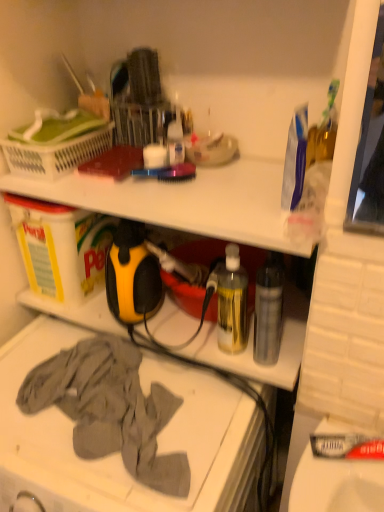
Question: Is translucent plastic bottle at center, placed as the 2th bottle when sorted from right to left, outside of transparent plastic bottle at center-right, which ranks as the 2th bottle in left-to-right order?

Choices:
 (A) yes
 (B) no

Answer: (A)

Question: From the image's perspective, is translucent plastic bottle at center, placed as the 2th bottle when sorted from right to left, beneath transparent plastic bottle at center-right, which ranks as the 2th bottle in left-to-right order?

Choices:
 (A) yes
 (B) no

Answer: (B)

Question: Considering the relative sizes of translucent plastic bottle at center, placed as the 2th bottle when sorted from right to left, and transparent plastic bottle at center-right, acting as the 1th bottle starting from the right, in the image provided, is translucent plastic bottle at center, placed as the 2th bottle when sorted from right to left, bigger than transparent plastic bottle at center-right, acting as the 1th bottle starting from the right,?

Choices:
 (A) no
 (B) yes

Answer: (B)

Question: Considering the relative sizes of translucent plastic bottle at center, placed as the 2th bottle when sorted from right to left, and transparent plastic bottle at center-right, which ranks as the 2th bottle in left-to-right order, in the image provided, is translucent plastic bottle at center, placed as the 2th bottle when sorted from right to left, taller than transparent plastic bottle at center-right, which ranks as the 2th bottle in left-to-right order,?

Choices:
 (A) no
 (B) yes

Answer: (A)

Question: Is translucent plastic bottle at center, placed as the 2th bottle when sorted from right to left, far away from transparent plastic bottle at center-right, which ranks as the 2th bottle in left-to-right order?

Choices:
 (A) no
 (B) yes

Answer: (A)

Question: Does translucent plastic bottle at center, acting as the 1th bottle starting from the left, have a smaller size compared to transparent plastic bottle at center-right, which ranks as the 2th bottle in left-to-right order?

Choices:
 (A) yes
 (B) no

Answer: (B)

Question: Considering the relative sizes of translucent plastic bottle at center, placed as the 2th bottle when sorted from right to left, and white plastic laundry basket at upper left in the image provided, is translucent plastic bottle at center, placed as the 2th bottle when sorted from right to left, smaller than white plastic laundry basket at upper left?

Choices:
 (A) no
 (B) yes

Answer: (B)

Question: Is translucent plastic bottle at center, acting as the 1th bottle starting from the left, next to white plastic laundry basket at upper left and touching it?

Choices:
 (A) no
 (B) yes

Answer: (A)

Question: Is translucent plastic bottle at center, placed as the 2th bottle when sorted from right to left, at the left side of white plastic laundry basket at upper left?

Choices:
 (A) no
 (B) yes

Answer: (A)

Question: Does translucent plastic bottle at center, placed as the 2th bottle when sorted from right to left, turn towards white plastic laundry basket at upper left?

Choices:
 (A) yes
 (B) no

Answer: (B)

Question: Can you confirm if translucent plastic bottle at center, acting as the 1th bottle starting from the left, is positioned to the right of white plastic laundry basket at upper left?

Choices:
 (A) yes
 (B) no

Answer: (A)

Question: Does translucent plastic bottle at center, placed as the 2th bottle when sorted from right to left, have a lesser width compared to white plastic laundry basket at upper left?

Choices:
 (A) yes
 (B) no

Answer: (A)

Question: Are transparent plastic bottle at center-right, acting as the 1th bottle starting from the right, and gray cotton cloth at lower left located far from each other?

Choices:
 (A) yes
 (B) no

Answer: (B)